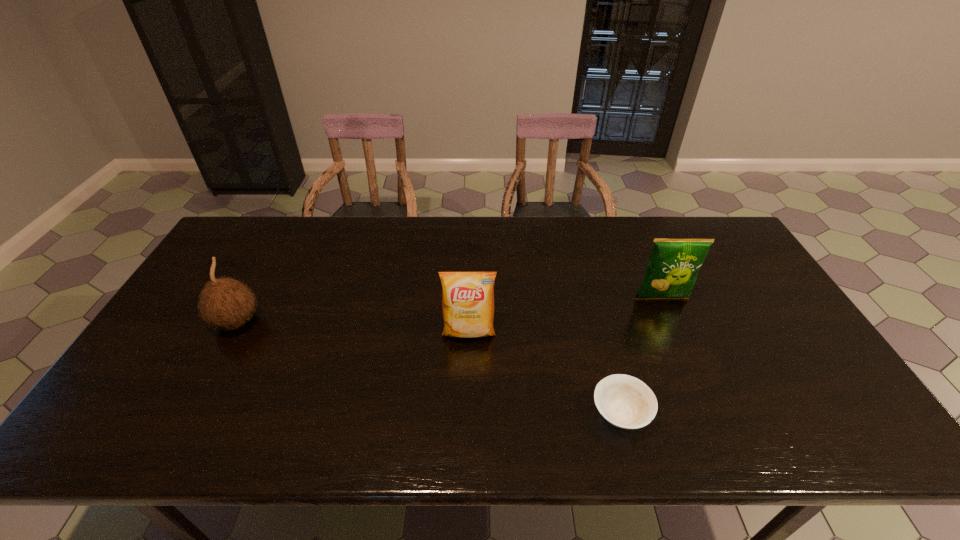
This screenshot has width=960, height=540. Find the location of `vacant space situated on the left of the shortest object`. vacant space situated on the left of the shortest object is located at coordinates (492, 413).

Locate an element on the screen. Image resolution: width=960 pixels, height=540 pixels. object that is at the near edge is located at coordinates (624, 401).

Where is `object that is positioned at the left edge`? object that is positioned at the left edge is located at coordinates (224, 303).

Locate an element on the screen. The height and width of the screenshot is (540, 960). free location at the far edge of the desktop is located at coordinates (541, 224).

At what (x,y) coordinates should I click in order to perform the action: click on vacant space at the near edge of the desktop. Please return your answer as a coordinate pair (x, y). The image size is (960, 540). Looking at the image, I should click on (448, 441).

At what (x,y) coordinates should I click in order to perform the action: click on blank area at the left edge. Please return your answer as a coordinate pair (x, y). Image resolution: width=960 pixels, height=540 pixels. Looking at the image, I should click on (149, 409).

Where is `vacant space at the right edge`? This screenshot has width=960, height=540. vacant space at the right edge is located at coordinates (808, 376).

This screenshot has width=960, height=540. I want to click on vacant space at the near left corner of the desktop, so click(154, 427).

In the image, there is a desktop. Where is `free region at the far right corner`? This screenshot has width=960, height=540. free region at the far right corner is located at coordinates (721, 239).

The height and width of the screenshot is (540, 960). I want to click on free space that is in between the bowl and the leftmost object, so click(429, 368).